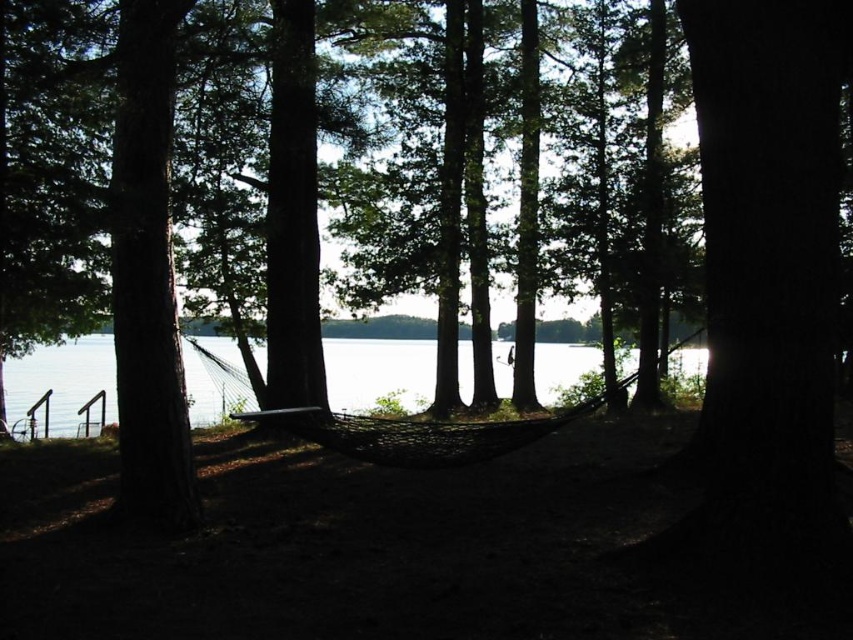
Is clear water at center shorter than black mesh hammock at center?

No.

Is clear water at center closer to the viewer compared to black mesh hammock at center?

No, clear water at center is further to the viewer.

Which is behind, point (630, 369) or point (268, 410)?

Point (630, 369)

Find the location of `clear water at center`. clear water at center is located at coordinates (62, 381).